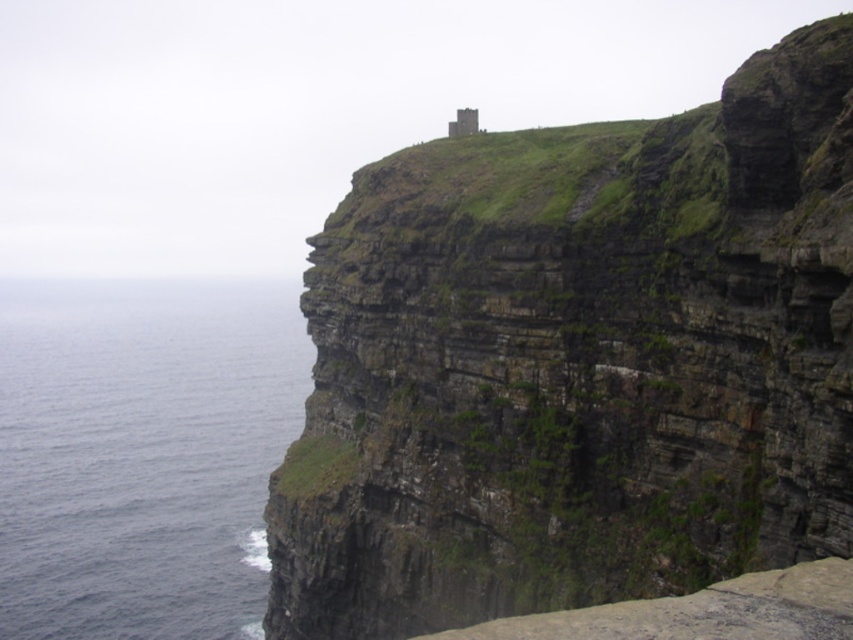
Question: Is green mossy rock at upper center wider than blue water at left?

Choices:
 (A) no
 (B) yes

Answer: (A)

Question: Which point is farther to the camera?

Choices:
 (A) (276, 291)
 (B) (599, 236)

Answer: (A)

Question: Is the position of green mossy rock at upper center more distant than that of blue water at left?

Choices:
 (A) no
 (B) yes

Answer: (A)

Question: Can you confirm if green mossy rock at upper center is positioned to the right of blue water at left?

Choices:
 (A) yes
 (B) no

Answer: (A)

Question: Which point is farther from the camera taking this photo?

Choices:
 (A) (525, 291)
 (B) (10, 596)

Answer: (B)